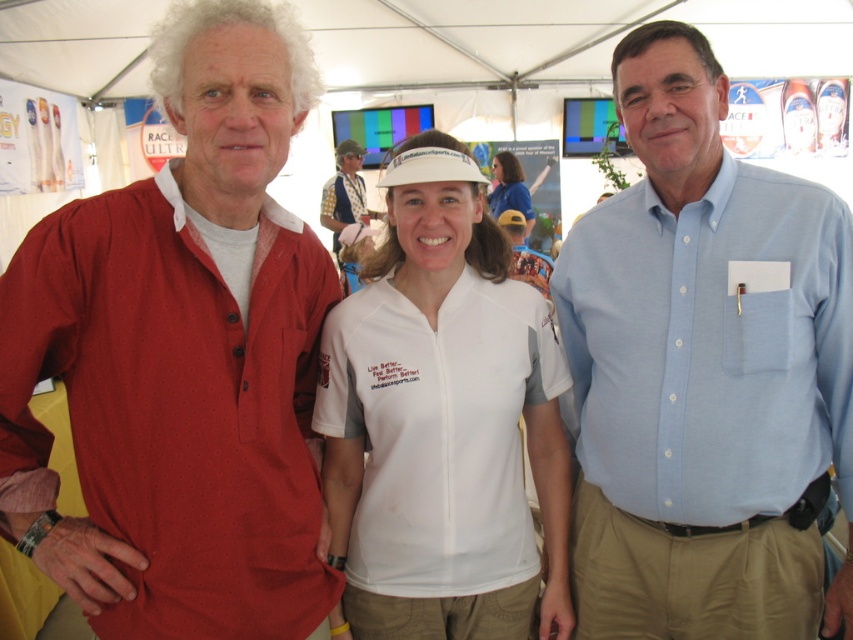
Does point (482, 384) lie in front of point (332, 189)?

That is True.

Does white fabric visor at center appear on the left side of checkered fabric shirt at center?

Incorrect, white fabric visor at center is not on the left side of checkered fabric shirt at center.

Which is in front, point (332, 355) or point (325, 198)?

Point (332, 355) is in front.

Find the location of a particular element. white fabric visor at center is located at coordinates (442, 433).

Between point (142, 348) and point (451, 422), which one is positioned in front?

Point (142, 348) is more forward.

Based on the photo, measure the distance between matte red shirt at center and white fabric visor at center.

matte red shirt at center is 29.64 centimeters away from white fabric visor at center.

Is point (207, 260) behind point (339, 396)?

That is False.

Identify the location of matte red shirt at center. (183, 356).

Is white fabric visor at center to the left of white matte visor at center from the viewer's perspective?

Yes, white fabric visor at center is to the left of white matte visor at center.

Does point (460, 305) come farther from viewer compared to point (520, 166)?

No, it is in front of (520, 166).

This screenshot has width=853, height=640. Identify the location of white fabric visor at center. (442, 433).